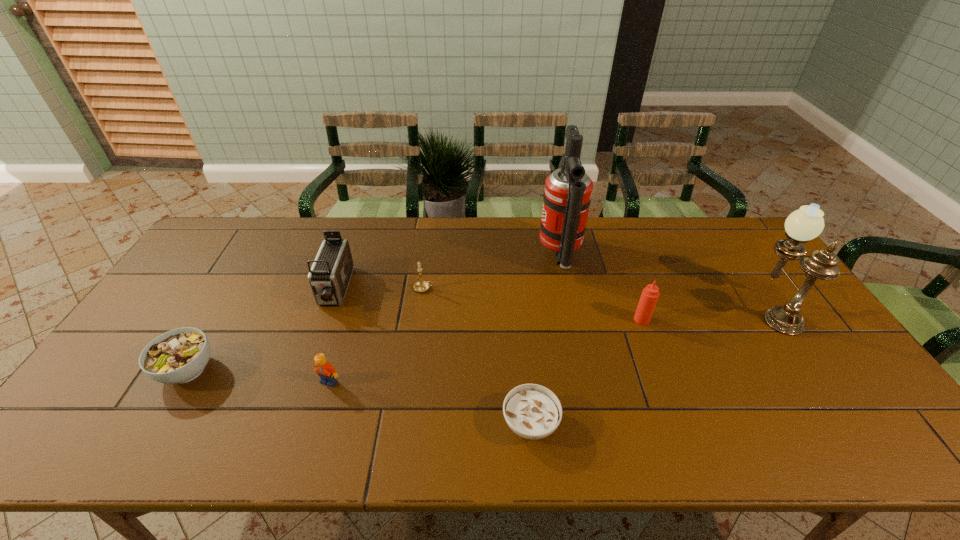
Image resolution: width=960 pixels, height=540 pixels. In order to click on the fourth object from right to left in this screenshot , I will do point(532,411).

The image size is (960, 540). I want to click on the nearest object, so pyautogui.click(x=532, y=411).

At what (x,y) coordinates should I click in order to perform the action: click on free location located 0.050m on the front label side of the tallest object. Please return your answer as a coordinate pair (x, y). Looking at the image, I should click on (523, 255).

Find the location of a particular element. This screenshot has height=540, width=960. vacant space located on the front label side of the tallest object is located at coordinates (464, 255).

Locate an element on the screen. The image size is (960, 540). vacant space positioned 0.150m on the front label side of the tallest object is located at coordinates (493, 255).

Locate an element on the screen. vacant space located 0.300m on the left of the second tallest object is located at coordinates (655, 308).

Locate an element on the screen. free location located at the lens of the camcorder is located at coordinates (317, 341).

At what (x,y) coordinates should I click in order to perform the action: click on free space located on the left of the Tabasco sauce. Please return your answer as a coordinate pair (x, y). The width and height of the screenshot is (960, 540). Looking at the image, I should click on (595, 320).

You are a GUI agent. You are given a task and a screenshot of the screen. Output one action in this format:
    pyautogui.click(x=<x>, y=<y>)
    Task: Click on the vacant space located on the handle side of the fifth object from right to left
    
    Given the screenshot: What is the action you would take?
    pyautogui.click(x=544, y=288)

At what (x,y) coordinates should I click in order to perform the action: click on vacant space positioned 0.150m on the front-facing side of the Lego. Please return your answer as a coordinate pair (x, y). The width and height of the screenshot is (960, 540). Looking at the image, I should click on pos(310,444).